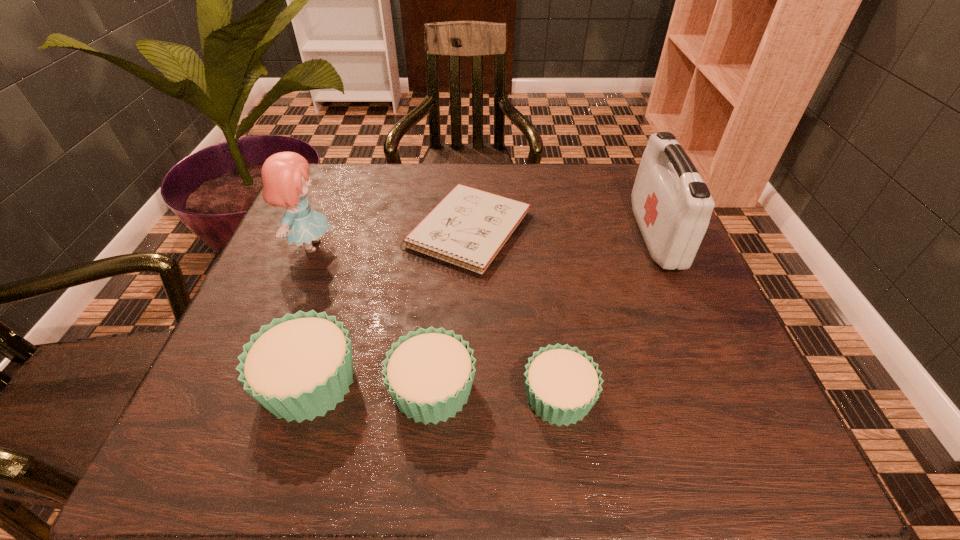
All cupcakes are currently evenly spaced. To continue this pattern, where would you add another cupcake on the right? Please point out a vacant spot. Please provide its 2D coordinates. Your answer should be formatted as a tuple, i.e. [(x, y)], where the tuple contains the x and y coordinates of a point satisfying the conditions above.

[(688, 403)]